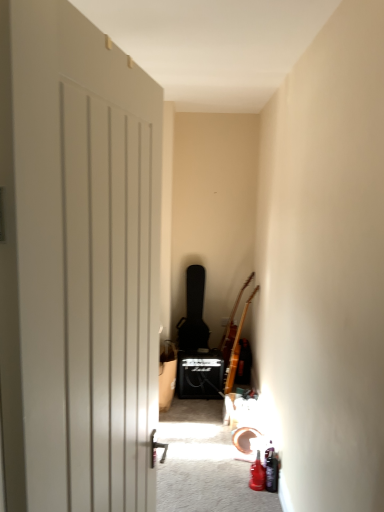
Question: Is wooden acoustic guitar at right, which is the 3th guitar in left-to-right order, located within black matte guitar case at center, the third guitar in the right-to-left sequence?

Choices:
 (A) yes
 (B) no

Answer: (B)

Question: From a real-world perspective, does black matte guitar case at center, arranged as the first guitar when viewed from the left, sit lower than wooden acoustic guitar at right, which is the 3th guitar in left-to-right order?

Choices:
 (A) no
 (B) yes

Answer: (A)

Question: Does black matte guitar case at center, the third guitar in the right-to-left sequence, have a smaller size compared to wooden acoustic guitar at right, which is the 3th guitar in left-to-right order?

Choices:
 (A) yes
 (B) no

Answer: (B)

Question: Does black matte guitar case at center, the third guitar in the right-to-left sequence, have a lesser height compared to wooden acoustic guitar at right, positioned as the first guitar in right-to-left order?

Choices:
 (A) yes
 (B) no

Answer: (A)

Question: Is wooden acoustic guitar at right, positioned as the first guitar in right-to-left order, at the back of black matte guitar case at center, the third guitar in the right-to-left sequence?

Choices:
 (A) yes
 (B) no

Answer: (B)

Question: Can you confirm if black matte guitar case at center, arranged as the first guitar when viewed from the left, is positioned to the left of wooden acoustic guitar at right, positioned as the first guitar in right-to-left order?

Choices:
 (A) no
 (B) yes

Answer: (B)

Question: Does brown wooden guitar at upper right, which is counted as the 2th guitar, starting from the left, lie in front of wooden acoustic guitar at right, positioned as the first guitar in right-to-left order?

Choices:
 (A) yes
 (B) no

Answer: (B)

Question: Does brown wooden guitar at upper right, the second guitar when ordered from right to left, have a greater height compared to wooden acoustic guitar at right, positioned as the first guitar in right-to-left order?

Choices:
 (A) yes
 (B) no

Answer: (B)

Question: Can you confirm if brown wooden guitar at upper right, which is counted as the 2th guitar, starting from the left, is shorter than wooden acoustic guitar at right, which is the 3th guitar in left-to-right order?

Choices:
 (A) no
 (B) yes

Answer: (B)

Question: Could you tell me if brown wooden guitar at upper right, the second guitar when ordered from right to left, is turned towards wooden acoustic guitar at right, which is the 3th guitar in left-to-right order?

Choices:
 (A) yes
 (B) no

Answer: (B)

Question: Considering the relative sizes of brown wooden guitar at upper right, the second guitar when ordered from right to left, and wooden acoustic guitar at right, positioned as the first guitar in right-to-left order, in the image provided, is brown wooden guitar at upper right, the second guitar when ordered from right to left, wider than wooden acoustic guitar at right, positioned as the first guitar in right-to-left order,?

Choices:
 (A) yes
 (B) no

Answer: (A)

Question: From the image's perspective, is brown wooden guitar at upper right, which is counted as the 2th guitar, starting from the left, over wooden acoustic guitar at right, which is the 3th guitar in left-to-right order?

Choices:
 (A) no
 (B) yes

Answer: (B)

Question: From the image's perspective, is black matte guitar case at center, the third guitar in the right-to-left sequence, under brown wooden guitar at upper right, which is counted as the 2th guitar, starting from the left?

Choices:
 (A) no
 (B) yes

Answer: (A)